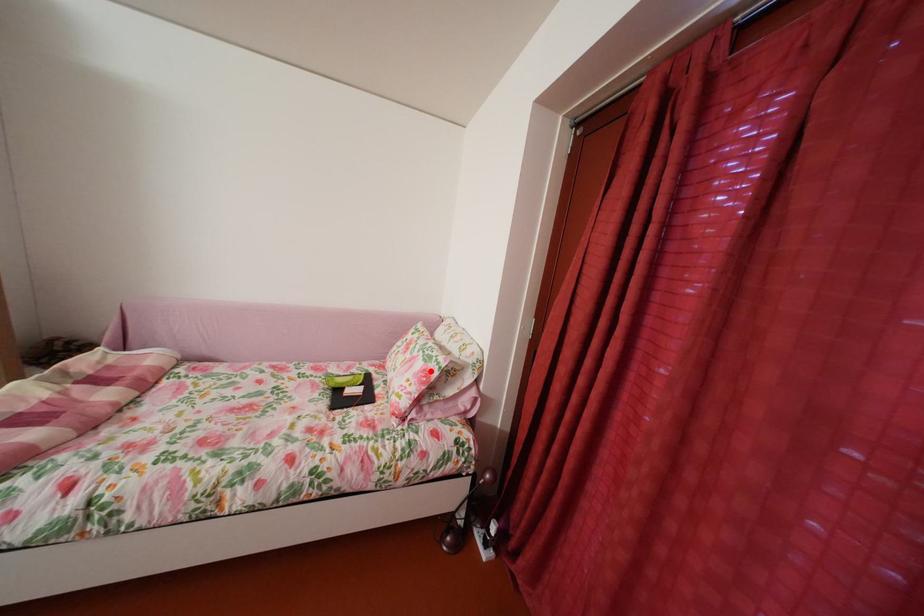
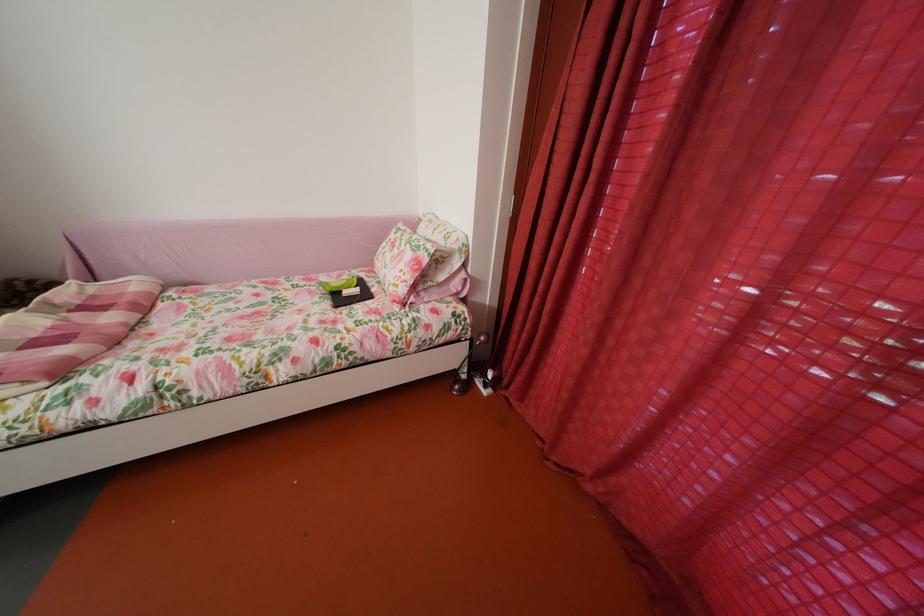
Question: A red point is marked in image1. In image2, is the corresponding 3D point closer to the camera or farther? Reply with the corresponding letter.

Choices:
 (A) The corresponding 3D point is closer.
 (B) The corresponding 3D point is farther.

Answer: (A)